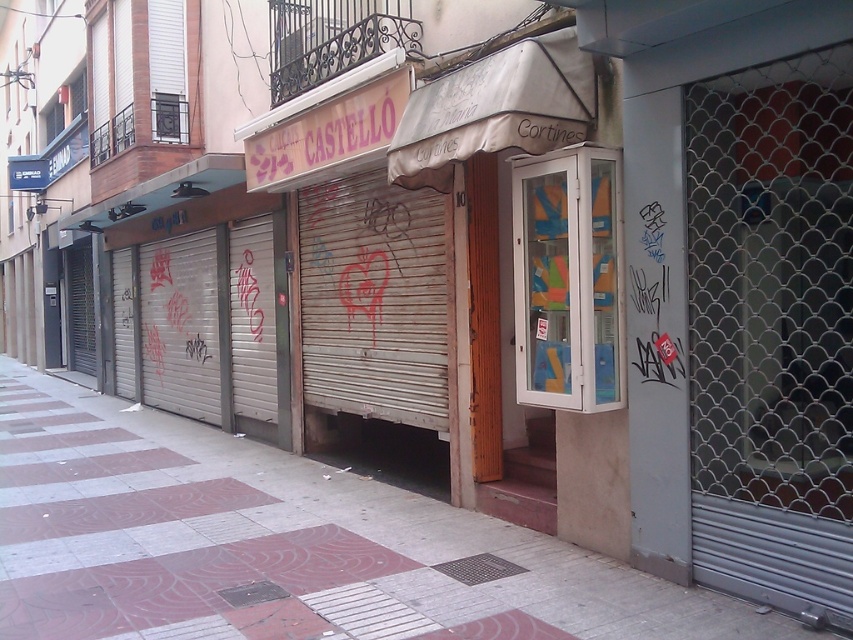
Question: Does metallic silver garage door at left lie behind clear glass cabinet at center?

Choices:
 (A) no
 (B) yes

Answer: (B)

Question: Which point is closer to the camera taking this photo?

Choices:
 (A) (555, 316)
 (B) (488, 529)

Answer: (A)

Question: Is metallic silver garage door at left behind clear glass cabinet at center?

Choices:
 (A) no
 (B) yes

Answer: (B)

Question: Which point is closer to the camera?

Choices:
 (A) (556, 392)
 (B) (149, 611)
 (C) (276, 358)

Answer: (B)

Question: Can you confirm if smooth concrete pavement at center is wider than metallic silver garage door at left?

Choices:
 (A) no
 (B) yes

Answer: (B)

Question: Which of the following is the farthest from the observer?

Choices:
 (A) metallic silver garage door at left
 (B) clear glass cabinet at center
 (C) smooth concrete pavement at center

Answer: (A)